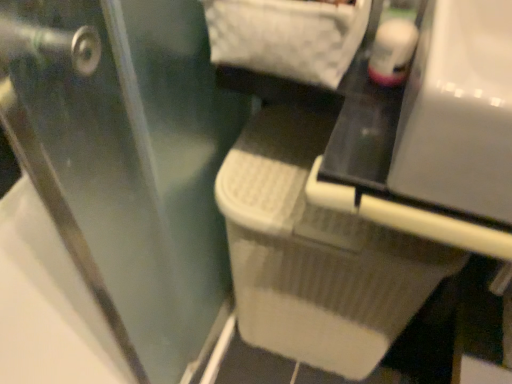
Question: Does white plastic vanity at center appear on the left side of transparent plastic screen door at lower right?

Choices:
 (A) no
 (B) yes

Answer: (A)

Question: Considering the relative sizes of white plastic vanity at center and transparent plastic screen door at lower right in the image provided, is white plastic vanity at center bigger than transparent plastic screen door at lower right?

Choices:
 (A) yes
 (B) no

Answer: (B)

Question: From the image's perspective, does white plastic vanity at center appear lower than transparent plastic screen door at lower right?

Choices:
 (A) no
 (B) yes

Answer: (A)

Question: Would you say transparent plastic screen door at lower right is part of white plastic vanity at center's contents?

Choices:
 (A) yes
 (B) no

Answer: (B)

Question: Is white plastic vanity at center behind transparent plastic screen door at lower right?

Choices:
 (A) yes
 (B) no

Answer: (A)

Question: Would you say white textured laundry basket at center is to the left or to the right of transparent plastic screen door at lower right in the picture?

Choices:
 (A) right
 (B) left

Answer: (A)

Question: From the image's perspective, is white textured laundry basket at center above or below transparent plastic screen door at lower right?

Choices:
 (A) below
 (B) above

Answer: (A)

Question: Considering the positions of white textured laundry basket at center and transparent plastic screen door at lower right in the image, is white textured laundry basket at center wider or thinner than transparent plastic screen door at lower right?

Choices:
 (A) wide
 (B) thin

Answer: (A)

Question: Does point (289, 342) appear closer or farther from the camera than point (207, 170)?

Choices:
 (A) farther
 (B) closer

Answer: (A)

Question: Is white textured laundry basket at center taller or shorter than white plastic vanity at center?

Choices:
 (A) short
 (B) tall

Answer: (B)

Question: Do you think white textured laundry basket at center is within white plastic vanity at center, or outside of it?

Choices:
 (A) outside
 (B) inside

Answer: (A)

Question: Looking at their shapes, would you say white textured laundry basket at center is wider or thinner than white plastic vanity at center?

Choices:
 (A) wide
 (B) thin

Answer: (B)

Question: Is point (361, 365) positioned closer to the camera than point (505, 39)?

Choices:
 (A) farther
 (B) closer

Answer: (A)

Question: From a real-world perspective, is transparent plastic screen door at lower right above or below white textured laundry basket at center?

Choices:
 (A) below
 (B) above

Answer: (B)

Question: In the image, is transparent plastic screen door at lower right on the left side or the right side of white textured laundry basket at center?

Choices:
 (A) right
 (B) left

Answer: (B)